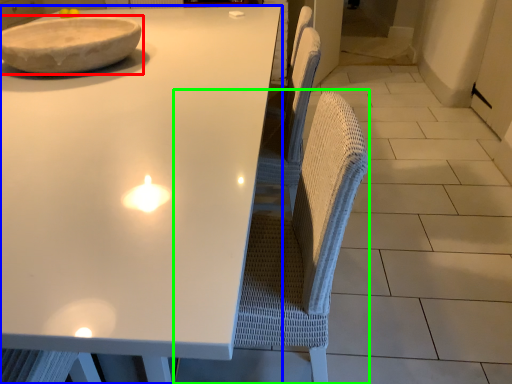
Question: Based on their relative distances, which object is nearer to bowl (highlighted by a red box)? Choose from table (highlighted by a blue box) and swivel chair (highlighted by a green box).

Choices:
 (A) table
 (B) swivel chair

Answer: (A)